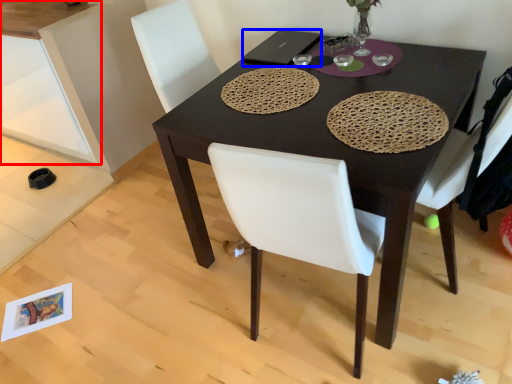
Question: Which point is closer to the camera, cabinetry (highlighted by a red box) or laptop (highlighted by a blue box)?

Choices:
 (A) cabinetry
 (B) laptop

Answer: (B)